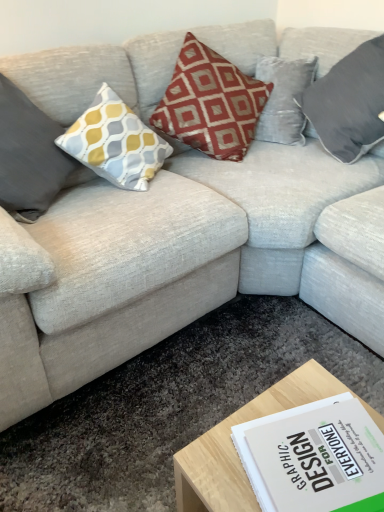
Question: Is yellow-grey patterned cushion at left, the 1th pillow viewed from the left, positioned far away from light wood coffee table at lower center?

Choices:
 (A) yes
 (B) no

Answer: (A)

Question: From the image's perspective, is yellow-grey patterned cushion at left, the 1th pillow viewed from the left, located beneath light wood coffee table at lower center?

Choices:
 (A) yes
 (B) no

Answer: (B)

Question: From a real-world perspective, does yellow-grey patterned cushion at left, the 1th pillow viewed from the left, stand above light wood coffee table at lower center?

Choices:
 (A) yes
 (B) no

Answer: (A)

Question: Is yellow-grey patterned cushion at left, placed as the third pillow when sorted from right to left, at the right side of light wood coffee table at lower center?

Choices:
 (A) yes
 (B) no

Answer: (B)

Question: Is yellow-grey patterned cushion at left, placed as the third pillow when sorted from right to left, thinner than light wood coffee table at lower center?

Choices:
 (A) no
 (B) yes

Answer: (B)

Question: Is yellow-grey patterned cushion at left, placed as the third pillow when sorted from right to left, outside of light wood coffee table at lower center?

Choices:
 (A) no
 (B) yes

Answer: (B)

Question: Does light wood coffee table at lower center have a lesser width compared to red velvet cushion at center, positioned as the second pillow in right-to-left order?

Choices:
 (A) no
 (B) yes

Answer: (B)

Question: From the image's perspective, is light wood coffee table at lower center located beneath red velvet cushion at center, the second pillow positioned from the left?

Choices:
 (A) no
 (B) yes

Answer: (B)

Question: Is light wood coffee table at lower center bigger than red velvet cushion at center, the second pillow positioned from the left?

Choices:
 (A) yes
 (B) no

Answer: (B)

Question: Is light wood coffee table at lower center beside red velvet cushion at center, positioned as the second pillow in right-to-left order?

Choices:
 (A) no
 (B) yes

Answer: (A)

Question: Can you confirm if light wood coffee table at lower center is positioned to the left of red velvet cushion at center, the second pillow positioned from the left?

Choices:
 (A) no
 (B) yes

Answer: (A)

Question: Can we say light wood coffee table at lower center lies outside red velvet cushion at center, the second pillow positioned from the left?

Choices:
 (A) yes
 (B) no

Answer: (A)

Question: From the image's perspective, is velvet gray pillow at upper right, which appears as the 1th pillow when viewed from the right, located beneath yellow-grey patterned cushion at left, placed as the third pillow when sorted from right to left?

Choices:
 (A) yes
 (B) no

Answer: (B)